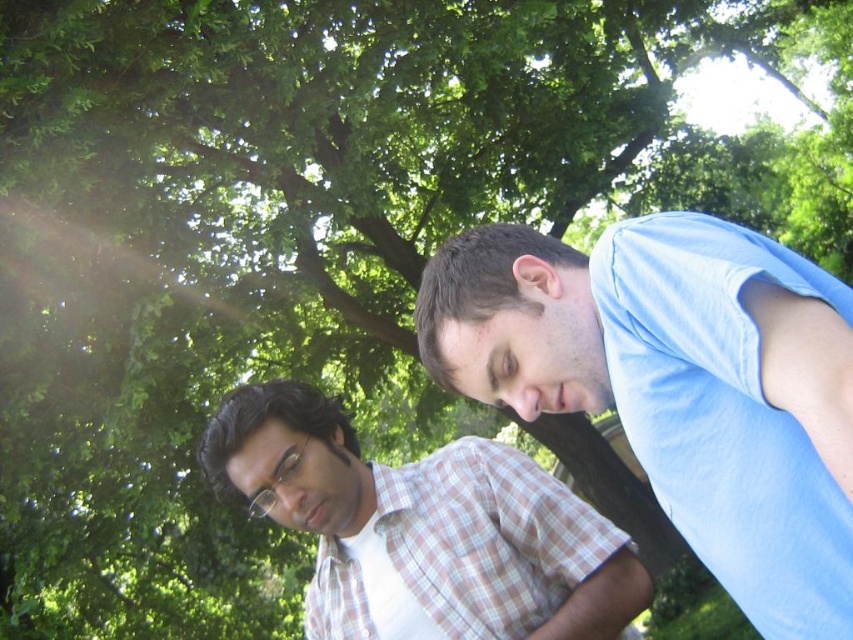
Does light blue cotton shirt at right appear under white checkered shirt at center?

Actually, light blue cotton shirt at right is above white checkered shirt at center.

Is light blue cotton shirt at right closer to the viewer compared to white checkered shirt at center?

Yes, light blue cotton shirt at right is in front of white checkered shirt at center.

The width and height of the screenshot is (853, 640). What do you see at coordinates (666, 387) in the screenshot?
I see `light blue cotton shirt at right` at bounding box center [666, 387].

You are a GUI agent. You are given a task and a screenshot of the screen. Output one action in this format:
    pyautogui.click(x=<x>, y=<y>)
    Task: Click on the light blue cotton shirt at right
    
    Given the screenshot: What is the action you would take?
    pyautogui.click(x=666, y=387)